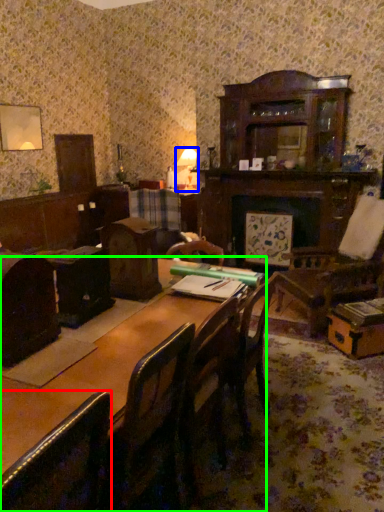
Question: Estimate the real-world distances between objects in this image. Which object is closer to chair (highlighted by a red box), table lamp (highlighted by a blue box) or table (highlighted by a green box)?

Choices:
 (A) table lamp
 (B) table

Answer: (B)